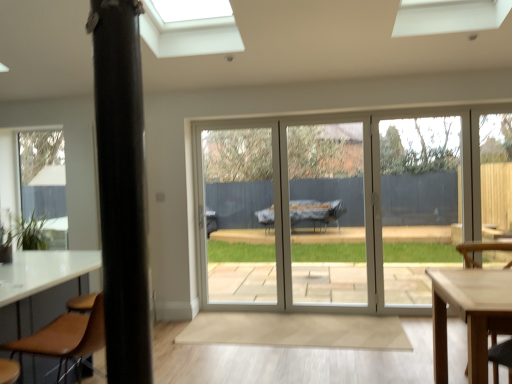
Question: Is wooden chair at lower right, which is the 2th chair from front to back, inside green matte plant at lower left?

Choices:
 (A) no
 (B) yes

Answer: (A)

Question: Does green matte plant at lower left have a lesser height compared to wooden chair at lower right, which appears as the 1th chair when viewed from the back?

Choices:
 (A) no
 (B) yes

Answer: (B)

Question: Considering the relative positions of green matte plant at lower left and wooden chair at lower right, the 1th chair in the right-to-left sequence, in the image provided, is green matte plant at lower left to the left of wooden chair at lower right, the 1th chair in the right-to-left sequence, from the viewer's perspective?

Choices:
 (A) yes
 (B) no

Answer: (A)

Question: Is green matte plant at lower left next to wooden chair at lower right, which is the 2th chair from front to back, and touching it?

Choices:
 (A) yes
 (B) no

Answer: (B)

Question: Is green matte plant at lower left turned away from wooden chair at lower right, which is the 2th chair from front to back?

Choices:
 (A) no
 (B) yes

Answer: (A)

Question: From the image's perspective, is black matte pole at left located above or below green matte plant at lower left?

Choices:
 (A) above
 (B) below

Answer: (A)

Question: Is point (120, 264) closer or farther from the camera than point (36, 231)?

Choices:
 (A) farther
 (B) closer

Answer: (B)

Question: Is black matte pole at left to the left or to the right of green matte plant at lower left in the image?

Choices:
 (A) right
 (B) left

Answer: (A)

Question: Based on their sizes in the image, would you say black matte pole at left is bigger or smaller than green matte plant at lower left?

Choices:
 (A) big
 (B) small

Answer: (B)

Question: Looking at the image, does brown leather chair at lower left, the 2th chair when ordered from back to front, seem bigger or smaller compared to black matte pole at left?

Choices:
 (A) small
 (B) big

Answer: (B)

Question: Is brown leather chair at lower left, which ranks as the 1th chair in front-to-back order, inside the boundaries of black matte pole at left, or outside?

Choices:
 (A) inside
 (B) outside

Answer: (B)

Question: Considering their positions, is brown leather chair at lower left, which is the 2th chair from right to left, located in front of or behind black matte pole at left?

Choices:
 (A) front
 (B) behind

Answer: (B)

Question: From a real-world perspective, relative to black matte pole at left, is brown leather chair at lower left, which ranks as the 1th chair in front-to-back order, vertically above or below?

Choices:
 (A) below
 (B) above

Answer: (A)

Question: Considering the positions of black matte pole at left and wooden chair at lower right, which appears as the 1th chair when viewed from the back, in the image, is black matte pole at left wider or thinner than wooden chair at lower right, which appears as the 1th chair when viewed from the back,?

Choices:
 (A) thin
 (B) wide

Answer: (A)

Question: From the image's perspective, is black matte pole at left located above or below wooden chair at lower right, which appears as the 1th chair when viewed from the back?

Choices:
 (A) above
 (B) below

Answer: (A)